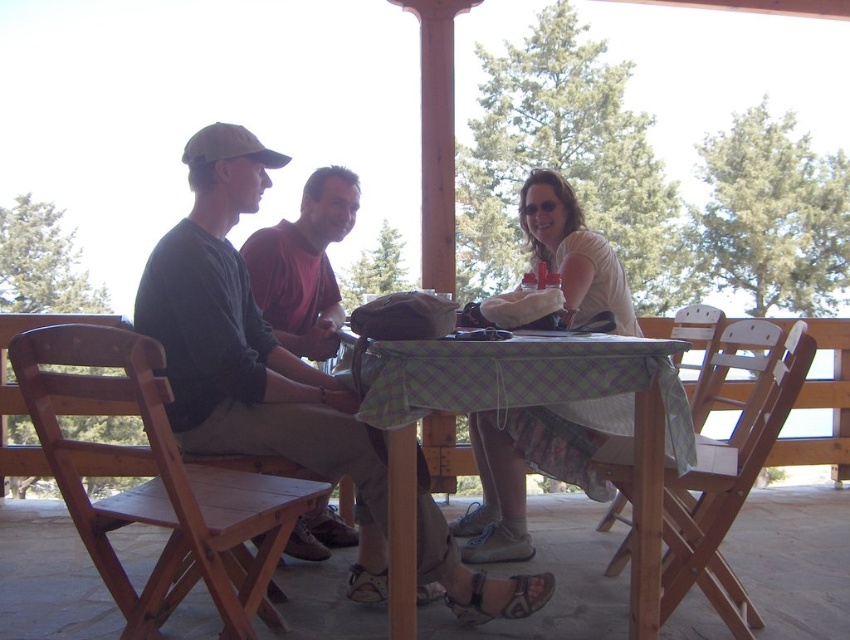
I want to click on matte black shirt at left, so click(248, 346).

Consider the image. Does matte black shirt at left have a lesser width compared to white cotton shirt at center?

No.

Which is behind, point (347, 388) or point (457, 536)?

The point (457, 536) is behind.

Where is `matte black shirt at left`? The image size is (850, 640). matte black shirt at left is located at coordinates (248, 346).

Between matte black shirt at left and checkered fabric table at center, which one has less height?

checkered fabric table at center is shorter.

Can you confirm if matte black shirt at left is wider than checkered fabric table at center?

Correct, the width of matte black shirt at left exceeds that of checkered fabric table at center.

Which is behind, point (367, 468) or point (514, 396)?

The point (367, 468) is more distant.

Locate an element on the screen. The height and width of the screenshot is (640, 850). matte black shirt at left is located at coordinates (248, 346).

Does checkered fabric table at center appear over matte black shirt at center?

No, checkered fabric table at center is not above matte black shirt at center.

Is point (615, 380) farther from camera compared to point (250, 257)?

That is False.

Locate an element on the screen. Image resolution: width=850 pixels, height=640 pixels. checkered fabric table at center is located at coordinates (518, 406).